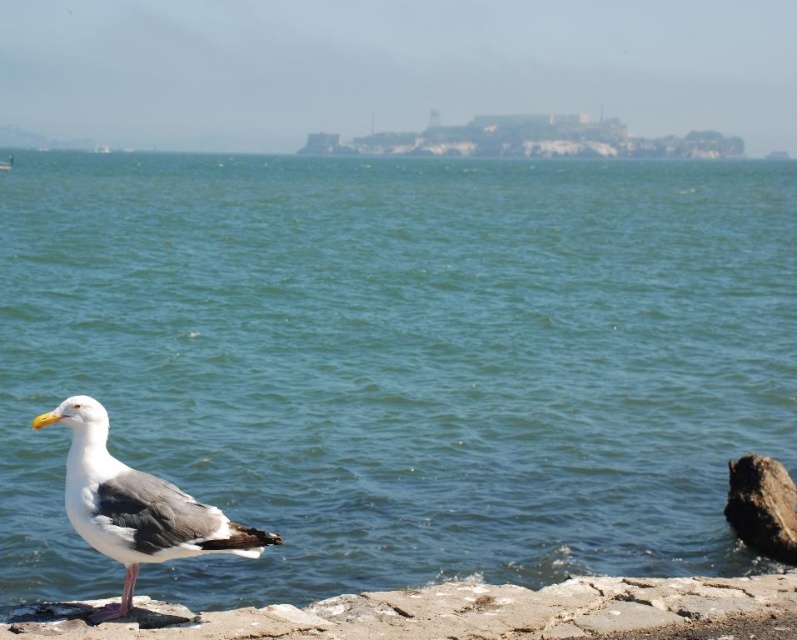
You are standing at the point marked by the coordinates point (x=397, y=362). Based on the scene description, what is the immediate environment around your current location?

The immediate environment around point (x=397, y=362) is blue water at center, as indicated by the coordinates.

You are a photographer standing in front of the coastal scene. You want to take a photo that includes both point A at point (450, 506) and point B at point (77, 477). Which point should be placed closer to the front of the photo to ensure both are visible?

Point B at point (77, 477) should be placed closer to the front of the photo because it is closer to the camera than point A at point (450, 506), ensuring both points are visible in the frame.